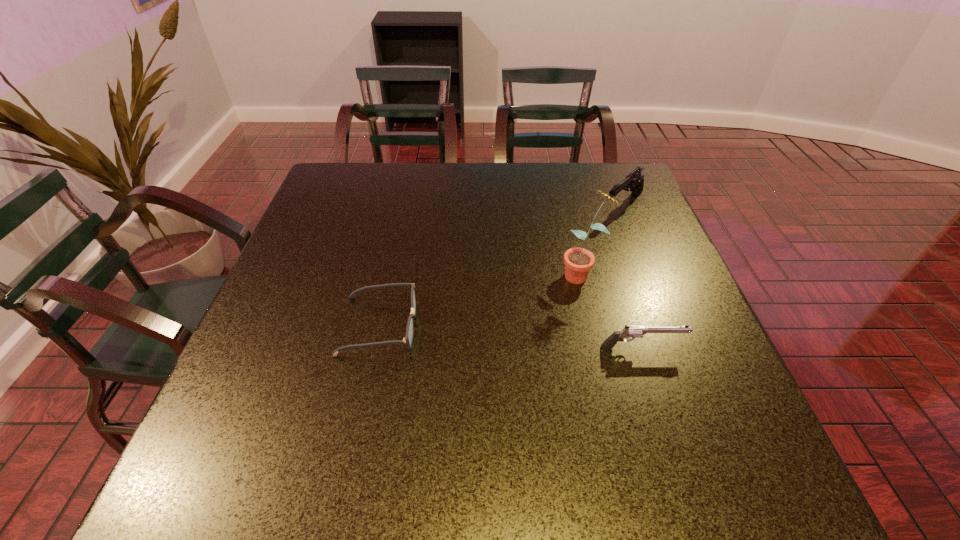
Locate an element on the screen. The width and height of the screenshot is (960, 540). spectacles is located at coordinates (408, 339).

At what (x,y) coordinates should I click in order to perform the action: click on the leftmost object. Please return your answer as a coordinate pair (x, y). Looking at the image, I should click on (408, 339).

Find the location of a particular element. the second shortest object is located at coordinates (628, 331).

Identify the location of sunflower. This screenshot has height=540, width=960. point(578,261).

Locate an element on the screen. The width and height of the screenshot is (960, 540). the tallest object is located at coordinates (578, 261).

This screenshot has width=960, height=540. I want to click on gun, so click(x=634, y=181).

Image resolution: width=960 pixels, height=540 pixels. Find the location of `the third shortest object`. the third shortest object is located at coordinates (634, 181).

Locate an element on the screen. vacant area situated on the face of the leftmost object is located at coordinates (598, 326).

The image size is (960, 540). I want to click on free space located on the front-facing side of the second shortest object, so [708, 347].

The width and height of the screenshot is (960, 540). I want to click on vacant space located on the flower of the sunflower, so click(424, 361).